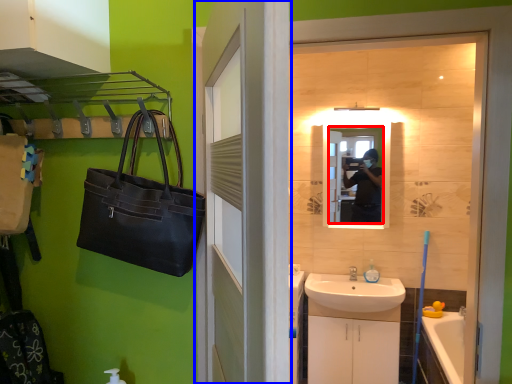
Question: Which object is further to the camera taking this photo, mirror (highlighted by a red box) or door (highlighted by a blue box)?

Choices:
 (A) mirror
 (B) door

Answer: (A)